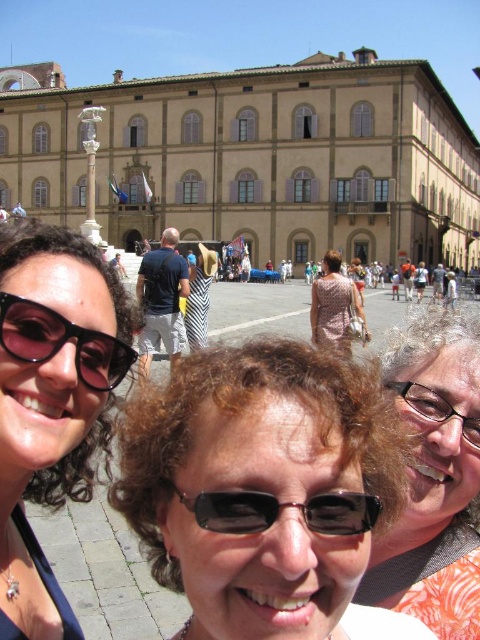
Who is more forward, (415,545) or (101,348)?

Point (101,348) is more forward.

Describe the element at coordinates (434, 480) in the screenshot. This screenshot has height=640, width=480. I see `curly hair at center` at that location.

Does point (408, 365) come farther from viewer compared to point (88, 387)?

Yes, it is behind point (88, 387).

Locate an element on the screen. The height and width of the screenshot is (640, 480). curly hair at center is located at coordinates click(434, 480).

Between point (109, 204) and point (84, 326), which one is positioned in front?

Positioned in front is point (84, 326).

Who is higher up, beige stone building at center or pink reflective sunglasses at upper left?

beige stone building at center

Is point (49, 97) in front of point (40, 344)?

That is False.

Locate an element on the screen. The height and width of the screenshot is (640, 480). beige stone building at center is located at coordinates (255, 157).

From the picture: Between matte black sunglasses at lower left and transparent plastic glasses at upper right, which one has less height?

transparent plastic glasses at upper right is shorter.

Is point (60, 365) positioned in front of point (406, 396)?

Yes, it is in front of point (406, 396).

The image size is (480, 640). Describe the element at coordinates (52, 396) in the screenshot. I see `matte black sunglasses at lower left` at that location.

Locate an element on the screen. matte black sunglasses at lower left is located at coordinates (52, 396).